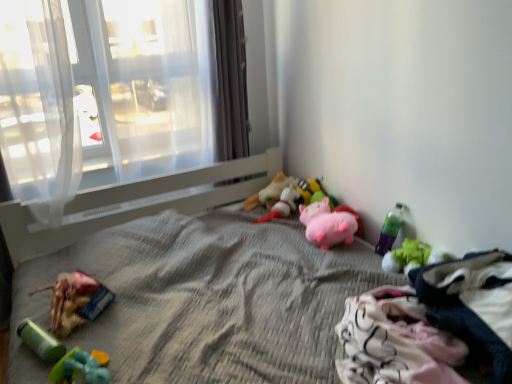
Question: Visually, is green plush toy at lower right, the 8th toy viewed from the left, positioned to the left or to the right of translucent fabric at upper left?

Choices:
 (A) left
 (B) right

Answer: (B)

Question: Would you say green plush toy at lower right, the first toy in the right-to-left sequence, is inside or outside translucent fabric at upper left?

Choices:
 (A) inside
 (B) outside

Answer: (B)

Question: Which is nearer to the soft plush toy at center, marked as the fifth toy in a right-to-left arrangement?

Choices:
 (A) translucent fabric at upper left
 (B) soft plush toy at center, acting as the 4th toy starting from the right
 (C) white sheer curtain at left, the 1th curtain from the left
 (D) green plastic bottle at lower right, which is the seventh toy in left-to-right order
 (E) white cotton clothing at lower right

Answer: (B)

Question: Estimate the real-world distances between objects in this image. Which object is closer to the green plush toy at lower right, the 8th toy viewed from the left?

Choices:
 (A) soft plush toy at center, marked as the fifth toy in a right-to-left arrangement
 (B) translucent fabric at upper left
 (C) satin gray curtain at center, the first curtain in the right-to-left sequence
 (D) plush toy at center, arranged as the third toy when viewed from the left
 (E) white cotton clothing at lower right

Answer: (E)